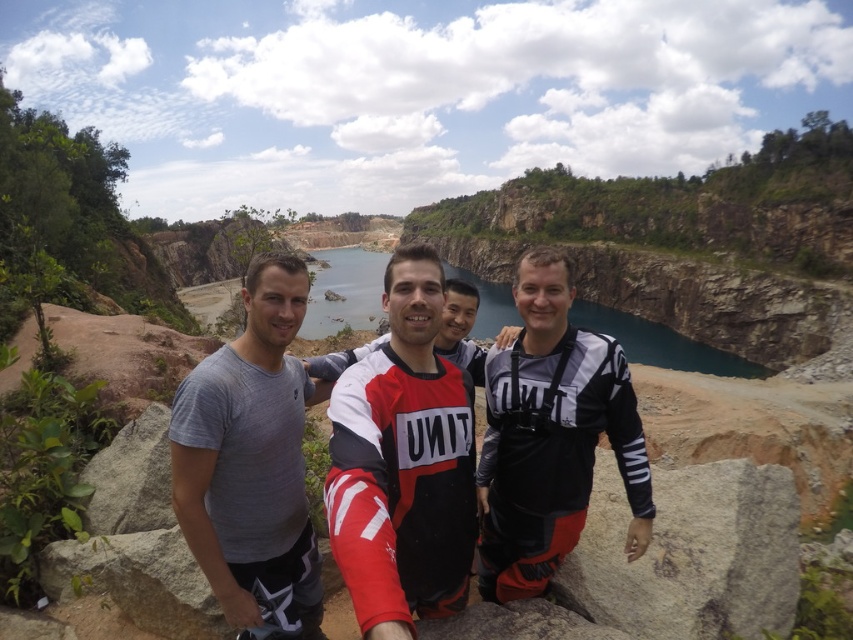
Question: Can you confirm if red and white jersey at center is bigger than gray matte t-shirt at center?

Choices:
 (A) no
 (B) yes

Answer: (A)

Question: Which of the following is the closest to the observer?

Choices:
 (A) black matte wetsuit at center
 (B) gray rough rock at center
 (C) red and white jersey at center
 (D) gray matte t-shirt at center

Answer: (C)

Question: Does red and white jersey at center have a larger size compared to gray rough rock at center?

Choices:
 (A) no
 (B) yes

Answer: (B)

Question: Considering the real-world distances, which object is closest to the red and white jersey at center?

Choices:
 (A) gray rough rock at center
 (B) black matte wetsuit at center
 (C) gray matte t-shirt at center

Answer: (C)

Question: Which point appears closest to the camera in this image?

Choices:
 (A) (299, 602)
 (B) (788, 472)
 (C) (531, 488)
 (D) (392, 410)

Answer: (A)

Question: Is red and white jersey at center below black matte wetsuit at center?

Choices:
 (A) no
 (B) yes

Answer: (B)